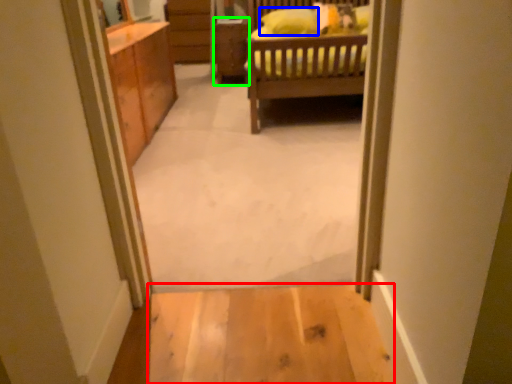
Question: Which object is the farthest from plain (highlighted by a red box)? Choose among these: pillow (highlighted by a blue box) or cabinetry (highlighted by a green box).

Choices:
 (A) pillow
 (B) cabinetry

Answer: (B)